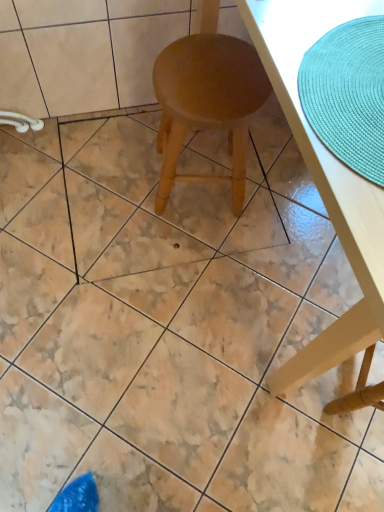
The image size is (384, 512). What do you see at coordinates (207, 102) in the screenshot?
I see `light brown wood stool at center` at bounding box center [207, 102].

Measure the distance between point (326, 138) and camera.

Point (326, 138) is 22.20 inches from camera.

Where is `light brown wood stool at center`? light brown wood stool at center is located at coordinates (207, 102).

Is wooden table at center oriented away from light brown wood stool at center?

No, wooden table at center is not facing the opposite direction of light brown wood stool at center.

Is wooden table at center next to light brown wood stool at center and touching it?

There is a gap between wooden table at center and light brown wood stool at center.

Is wooden table at center completely or partially outside of light brown wood stool at center?

Yes, wooden table at center is located beyond the bounds of light brown wood stool at center.

From a real-world perspective, between wooden table at center and light brown wood stool at center, who is vertically higher?

In real-world perspective, wooden table at center is above.

Can you confirm if light brown wood stool at center is taller than wooden table at center?

Incorrect, the height of light brown wood stool at center is not larger of that of wooden table at center.

Choose the correct answer: Is light brown wood stool at center inside wooden table at center or outside it?

light brown wood stool at center can be found inside wooden table at center.

Is point (200, 77) closer to viewer compared to point (328, 164)?

No, it is behind (328, 164).

Is teal woven placemat at upper right located outside light brown wood stool at center?

Yes, teal woven placemat at upper right is not within light brown wood stool at center.

Which object is positioned more to the left, teal woven placemat at upper right or light brown wood stool at center?

light brown wood stool at center.

How many degrees apart are the facing directions of teal woven placemat at upper right and light brown wood stool at center?

85.9 degrees.

From the image's perspective, is teal woven placemat at upper right above or below light brown wood stool at center?

From the image's perspective, teal woven placemat at upper right appears below light brown wood stool at center.

Is wooden table at center far from teal woven placemat at upper right?

No, wooden table at center is in close proximity to teal woven placemat at upper right.

Is teal woven placemat at upper right at the back of wooden table at center?

No, wooden table at center is not facing the opposite direction of teal woven placemat at upper right.

Is wooden table at center smaller than teal woven placemat at upper right?

No.

This screenshot has height=512, width=384. I want to click on table lying in front of the teal woven placemat at upper right, so [x=326, y=190].

From a real-world perspective, which is physically above, teal woven placemat at upper right or wooden table at center?

From a 3D spatial view, teal woven placemat at upper right is above.

Is teal woven placemat at upper right behind wooden table at center?

Yes, the depth of teal woven placemat at upper right is greater than that of wooden table at center.

From their relative heights in the image, would you say teal woven placemat at upper right is taller or shorter than wooden table at center?

Clearly, teal woven placemat at upper right is shorter compared to wooden table at center.

Measure the distance between teal woven placemat at upper right and wooden table at center.

6.71 inches.

Considering the relative sizes of light brown wood stool at center and teal woven placemat at upper right in the image provided, is light brown wood stool at center smaller than teal woven placemat at upper right?

Actually, light brown wood stool at center might be larger than teal woven placemat at upper right.

From a real-world perspective, relative to teal woven placemat at upper right, is light brown wood stool at center vertically above or below?

light brown wood stool at center is below teal woven placemat at upper right.

This screenshot has height=512, width=384. What are the coordinates of `mat that appears on the right of light brown wood stool at center` in the screenshot? It's located at [348, 94].

Which object is positioned more to the right, light brown wood stool at center or teal woven placemat at upper right?

From the viewer's perspective, teal woven placemat at upper right appears more on the right side.

You are a GUI agent. You are given a task and a screenshot of the screen. Output one action in this format:
    pyautogui.click(x=<x>, y=<y>)
    Task: Click on the stool that appears behind the wooden table at center
    The height and width of the screenshot is (512, 384).
    Given the screenshot: What is the action you would take?
    pyautogui.click(x=207, y=102)

Image resolution: width=384 pixels, height=512 pixels. In order to click on table below the light brown wood stool at center (from the image's perspective) in this screenshot , I will do `click(326, 190)`.

Consider the image. Looking at the image, which one is located closer to teal woven placemat at upper right, wooden table at center or light brown wood stool at center?

wooden table at center.

Considering their positions, is light brown wood stool at center positioned closer to wooden table at center than teal woven placemat at upper right?

Among the two, teal woven placemat at upper right is located nearer to wooden table at center.

Considering their positions, is wooden table at center positioned closer to light brown wood stool at center than teal woven placemat at upper right?

Based on the image, wooden table at center appears to be nearer to light brown wood stool at center.

From the image, which object appears to be farther from teal woven placemat at upper right, light brown wood stool at center or wooden table at center?

light brown wood stool at center is positioned further to the anchor teal woven placemat at upper right.

Based on their spatial positions, is teal woven placemat at upper right or wooden table at center further from light brown wood stool at center?

Among the two, teal woven placemat at upper right is located further to light brown wood stool at center.

From the image, which object appears to be nearer to wooden table at center, teal woven placemat at upper right or light brown wood stool at center?

The object closer to wooden table at center is teal woven placemat at upper right.

What are the coordinates of `mat positioned between wooden table at center and light brown wood stool at center from near to far` in the screenshot? It's located at (348, 94).